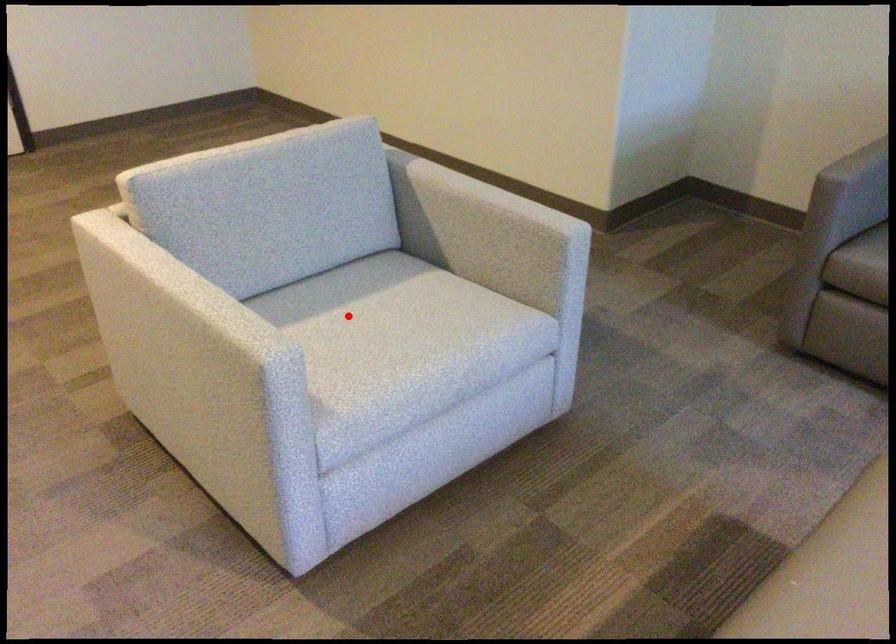
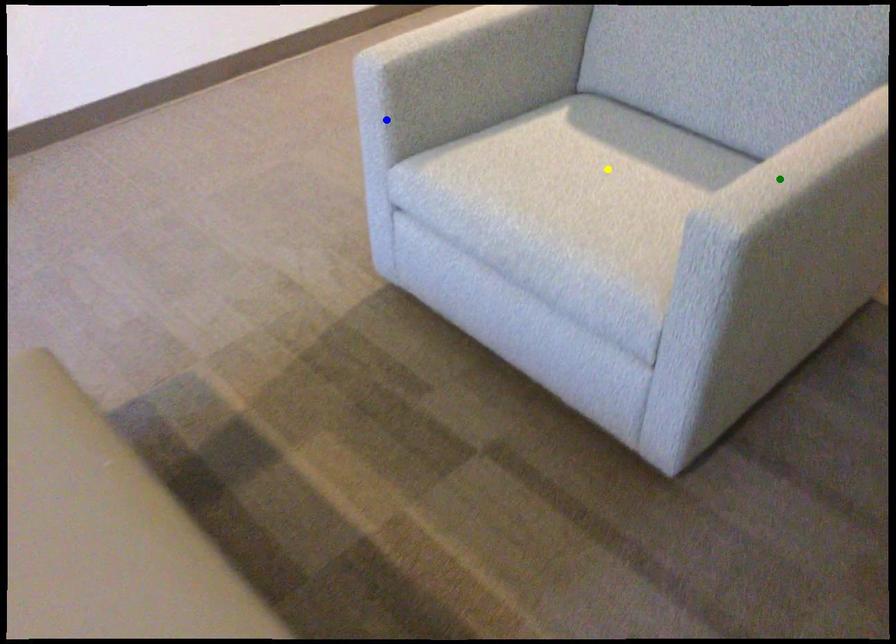
Question: I am providing you with two images of the same scene from different viewpoints. A red point is marked on the first image. You are given multiple points on the second image. Which spot in image 2 lines up with the point in image 1?

Choices:
 (A) blue point
 (B) green point
 (C) yellow point

Answer: (C)